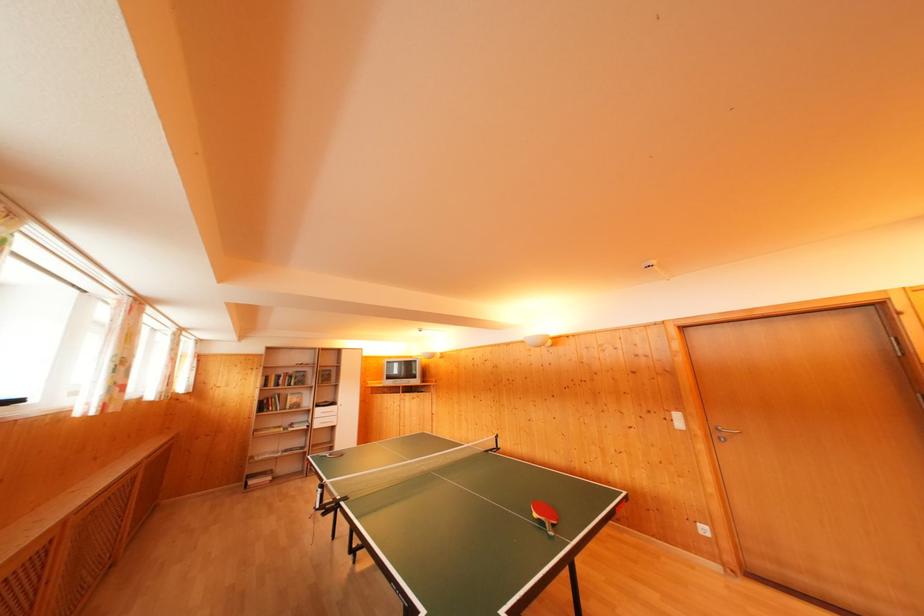
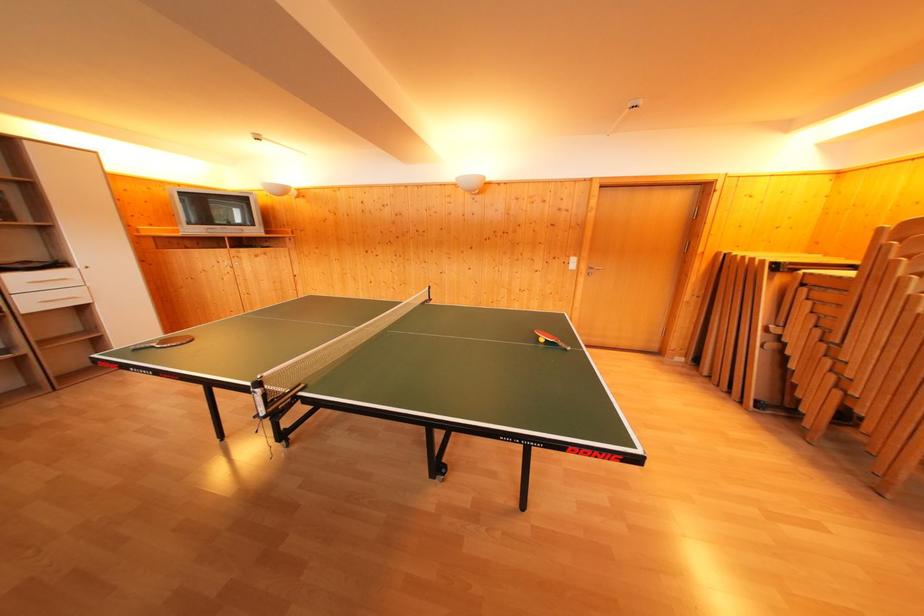
In the second image, find the point that corresponds to [338,408] in the first image.

(64, 270)